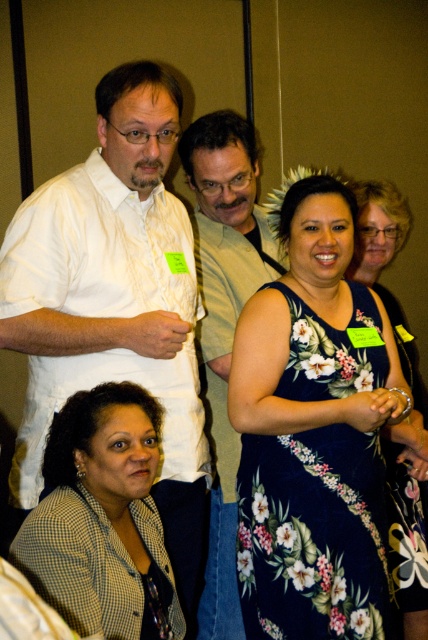
Between point (258, 552) and point (400, 513), which one is positioned in front?

Positioned in front is point (258, 552).

What do you see at coordinates (314, 429) in the screenshot?
I see `dark blue floral dress at center` at bounding box center [314, 429].

Locate an element on the screen. This screenshot has width=428, height=640. dark blue floral dress at center is located at coordinates (314, 429).

Can you confirm if white shirt at upper left is taller than floral print dress at center?

Yes, white shirt at upper left is taller than floral print dress at center.

Is point (29, 456) farther from camera compared to point (359, 225)?

That is False.

Image resolution: width=428 pixels, height=640 pixels. Describe the element at coordinates (115, 301) in the screenshot. I see `white shirt at upper left` at that location.

At what (x,y) coordinates should I click in order to perform the action: click on white shirt at upper left. Please return your answer as a coordinate pair (x, y). Looking at the image, I should click on (115, 301).

Between point (234, 211) and point (407, 484), which one is positioned behind?

Positioned behind is point (407, 484).

At what (x,y) coordinates should I click in order to perform the action: click on green fabric shirt at center. Please return your answer as a coordinate pair (x, y). Image resolution: width=428 pixels, height=640 pixels. Looking at the image, I should click on (223, 324).